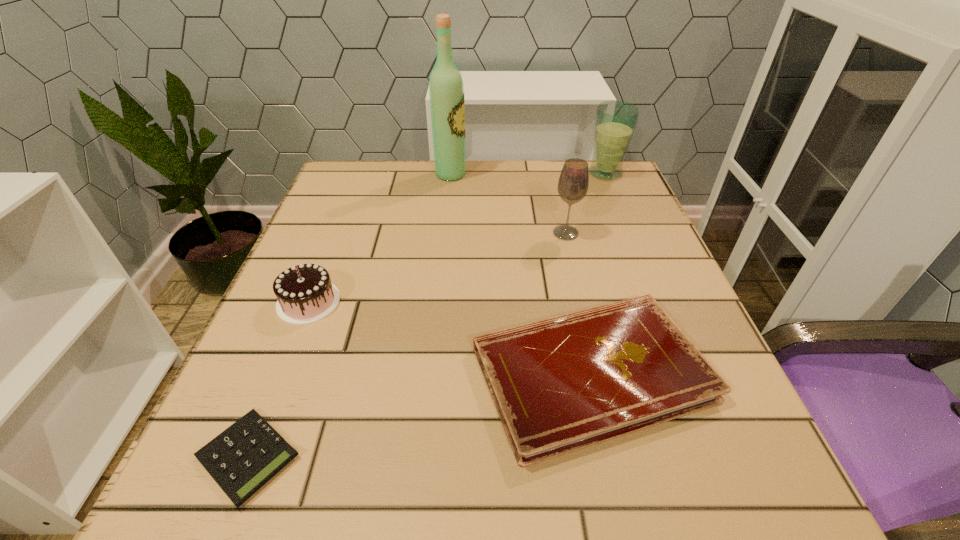
At what (x,y) coordinates should I click in order to perform the action: click on the third object from left to right. Please return your answer as a coordinate pair (x, y). The height and width of the screenshot is (540, 960). Looking at the image, I should click on (446, 91).

Identify the location of the tallest object. Image resolution: width=960 pixels, height=540 pixels. (446, 91).

What are the coordinates of `the farther glass drink container` in the screenshot? It's located at (615, 121).

In order to click on the nearer glass drink container in this screenshot , I will do `click(573, 182)`.

This screenshot has height=540, width=960. Identify the location of the fourth nearest object. (573, 182).

At what (x,y) coordinates should I click in order to perform the action: click on the third shortest object. Please return your answer as a coordinate pair (x, y). Looking at the image, I should click on (305, 294).

Locate an element on the screen. This screenshot has width=960, height=540. the second shortest object is located at coordinates (565, 383).

The height and width of the screenshot is (540, 960). In order to click on calculator in this screenshot , I will do `click(244, 457)`.

At what (x,y) coordinates should I click in order to perform the action: click on vacant space located on the front-facing side of the fourth object from right to left. Please return your answer as a coordinate pair (x, y). The height and width of the screenshot is (540, 960). Looking at the image, I should click on (532, 174).

In order to click on vacant space located on the front of the farther glass drink container in this screenshot , I will do pos(624,217).